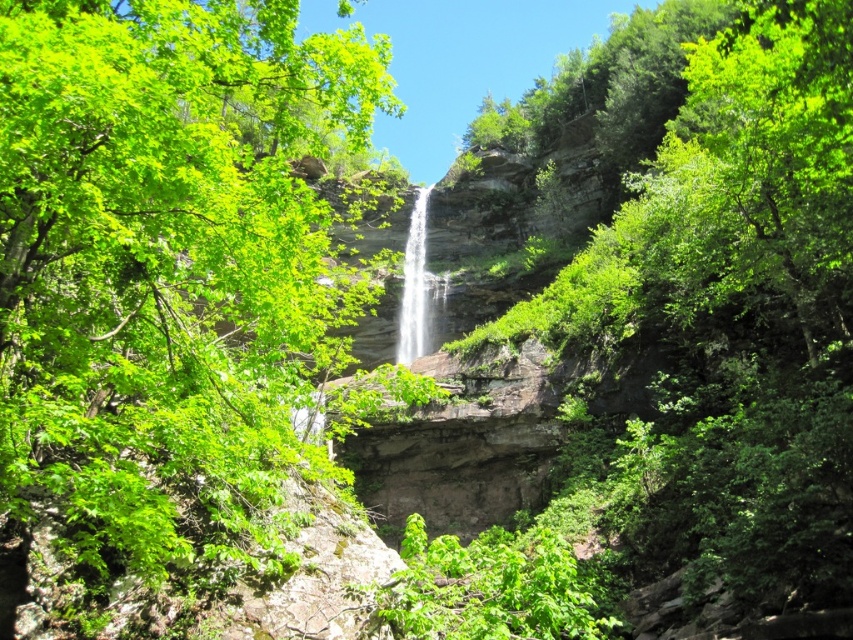
Does point (97, 310) come closer to viewer compared to point (410, 355)?

That is True.

Between point (248, 10) and point (415, 269), which one is positioned behind?

The point (415, 269) is more distant.

Where is `green leafy tree at center`? green leafy tree at center is located at coordinates (166, 264).